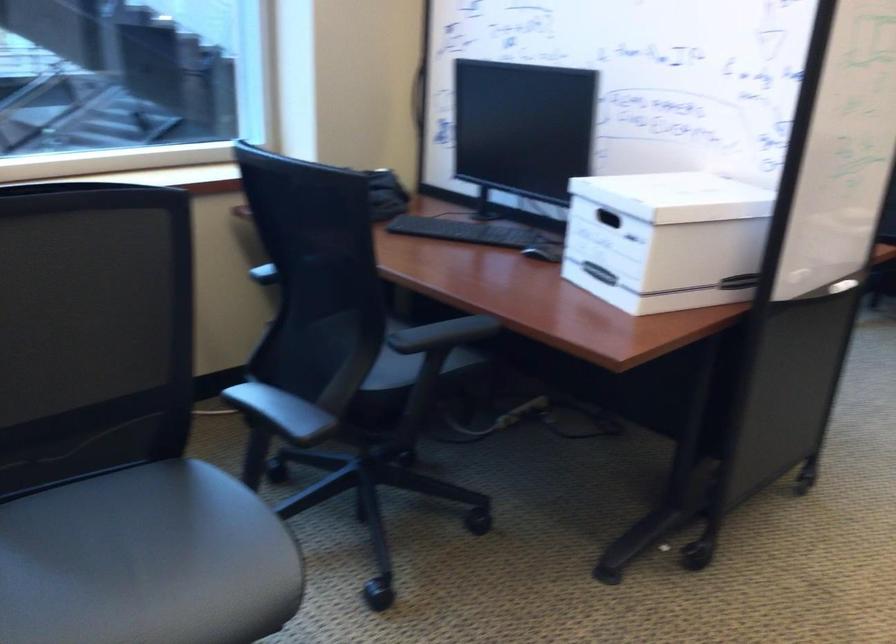
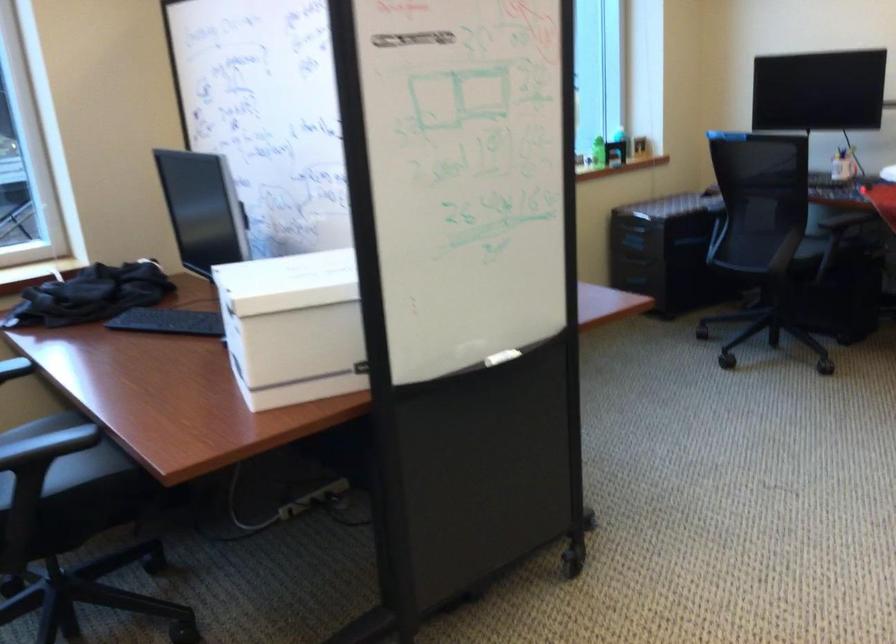
Locate, in the second image, the point that corresponds to pixel 684 242 in the first image.

(293, 327)